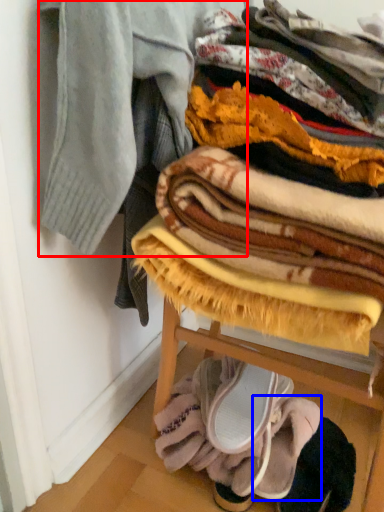
Question: Which object is closer to the camera taking this photo, garment (highlighted by a red box) or footwear (highlighted by a blue box)?

Choices:
 (A) garment
 (B) footwear

Answer: (A)